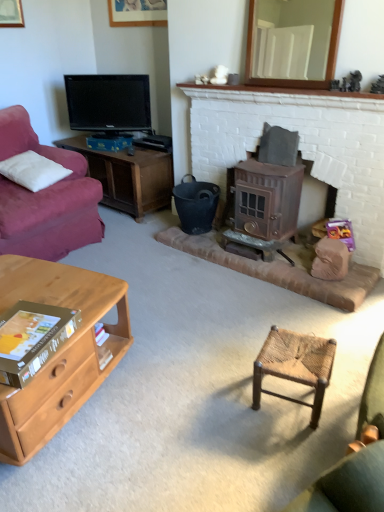
Find the location of a particular element. free space above bronze metallic wood burning stove at center-right (from a real-world perspective) is located at coordinates (271, 164).